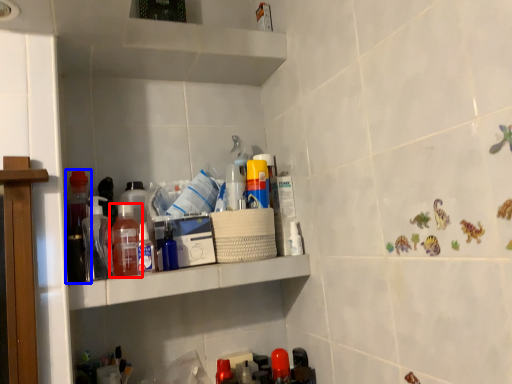
Question: Among these objects, which one is farthest to the camera, bottle (highlighted by a red box) or bottle (highlighted by a blue box)?

Choices:
 (A) bottle
 (B) bottle

Answer: (B)